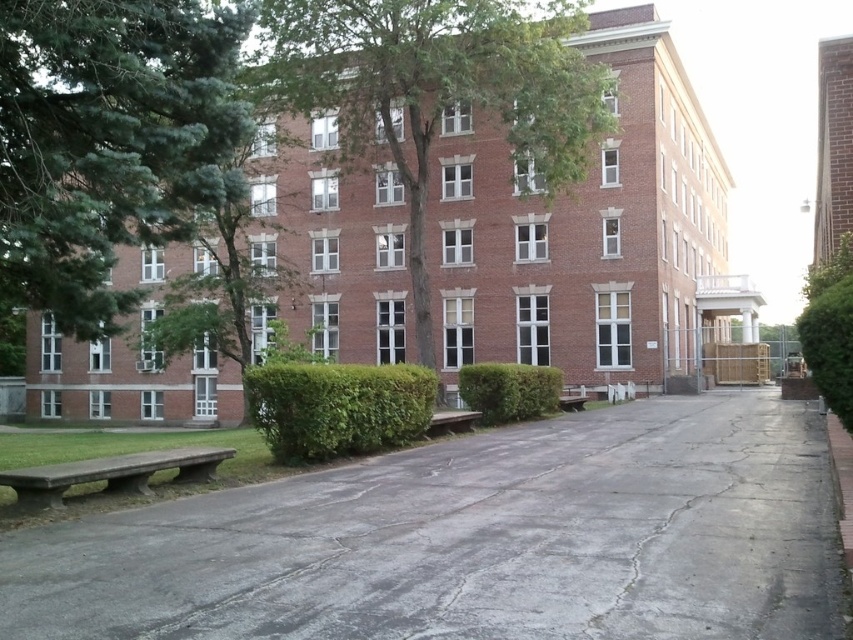
Consider the image. Can you confirm if gray concrete pavement at center is shorter than green leafy tree at upper left?

Yes, gray concrete pavement at center is shorter than green leafy tree at upper left.

Consider the image. Who is lower down, gray concrete pavement at center or green leafy tree at upper left?

gray concrete pavement at center is lower down.

Which is behind, point (12, 576) or point (196, 19)?

The point (196, 19) is behind.

At what (x,y) coordinates should I click in order to perform the action: click on gray concrete pavement at center. Please return your answer as a coordinate pair (x, y). Looking at the image, I should click on (474, 540).

In the scene shown: Is green leafy tree at upper left behind concrete bench at lower left?

No, it is in front of concrete bench at lower left.

Is green leafy tree at upper left taller than concrete bench at lower left?

Yes.

Measure the distance between point [151,104] and camera.

8.34 meters

Image resolution: width=853 pixels, height=640 pixels. What are the coordinates of `green leafy tree at upper left` in the screenshot? It's located at (109, 141).

Between green leafy tree at upper left and brown wooden bench at center, which one has more height?

With more height is green leafy tree at upper left.

Which is in front, point (21, 58) or point (456, 413)?

Point (21, 58) is in front.

This screenshot has width=853, height=640. What are the coordinates of `green leafy tree at upper left` in the screenshot? It's located at (109, 141).